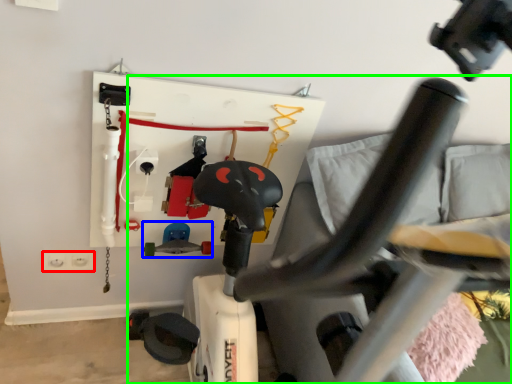
Question: Considering the real-world distances, which object is closest to electric outlet (highlighted by a red box)? toy (highlighted by a blue box) or swivel chair (highlighted by a green box).

Choices:
 (A) toy
 (B) swivel chair

Answer: (A)